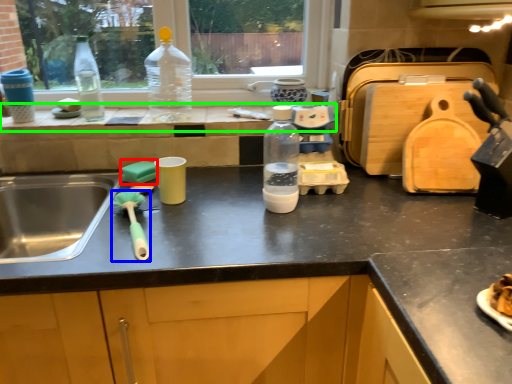
Question: Estimate the real-world distances between objects in this image. Which object is farther from food (highlighted by a red box), brush (highlighted by a blue box) or window sill (highlighted by a green box)?

Choices:
 (A) brush
 (B) window sill

Answer: (B)